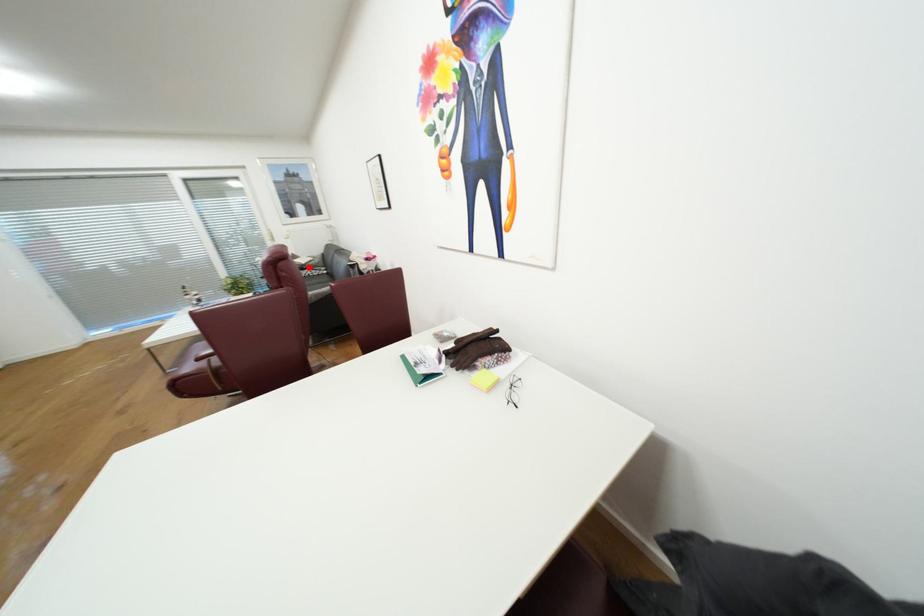
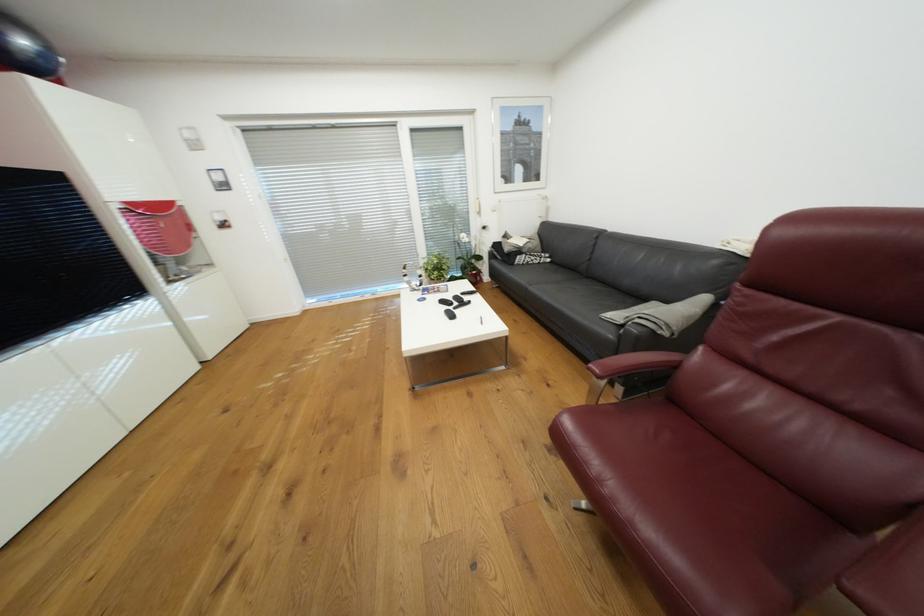
In the second image, find the point that corresponds to the highlighted location in the first image.

(526, 252)